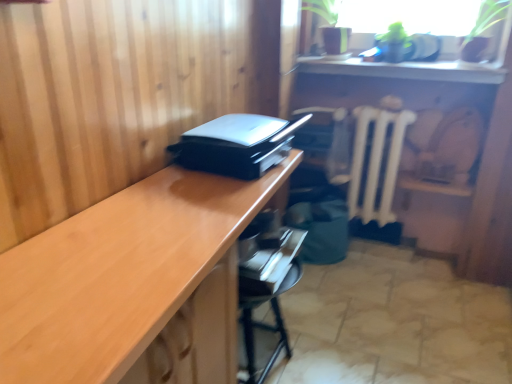
Locate an element on the screen. The height and width of the screenshot is (384, 512). vacant space in black plastic drawer at center (from a real-world perspective) is located at coordinates (307, 179).